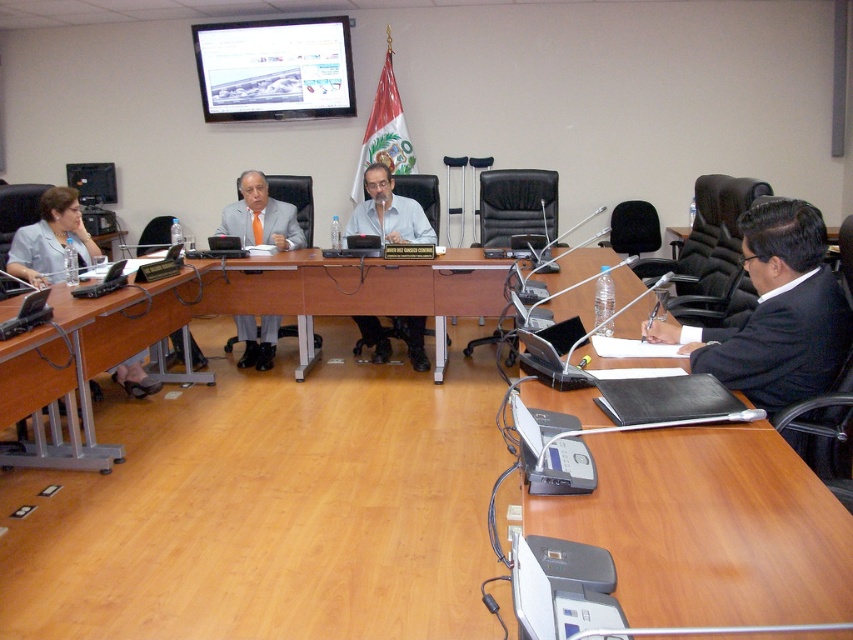
You are standing in the conference room and want to place a new speaker at the point marked as point (416, 339). The speaker requires a space that is at least 4 meters away from the camera to avoid feedback. Is this point suitable for placing the speaker?

The distance of point (416, 339) from camera is 5.08 meters, which is more than the required 4 meters. Therefore, the point is suitable for placing the speaker to avoid feedback.

You are organizing a meeting and need to place a 2.5 feet wide laptop on the brown wooden table at lower left or the matte gray suit at left. Which object can accommodate the laptop without exceeding its width?

The brown wooden table at lower left can accommodate the laptop since its width is greater than the matte gray suit at left.

You are organizing a virtual meeting and need to ensure that both the matte black laptop at center and the matte black laptop at left are visible to participants. Given that the camera you have can capture a field of view up to 3 meters wide, will both laptops fit within the camera frame?

The matte black laptop at center and matte black laptop at left are 3.02 meters apart, which exceeds the camera field of view of 3 meters. Therefore, both laptops cannot fit within the camera frame simultaneously.